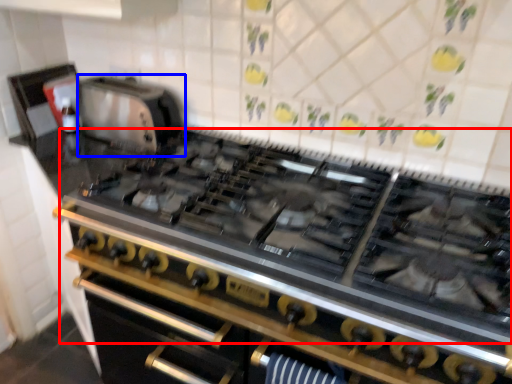
Question: Which of the following is the farthest to the observer, gas stove (highlighted by a red box) or appliance (highlighted by a blue box)?

Choices:
 (A) gas stove
 (B) appliance

Answer: (B)